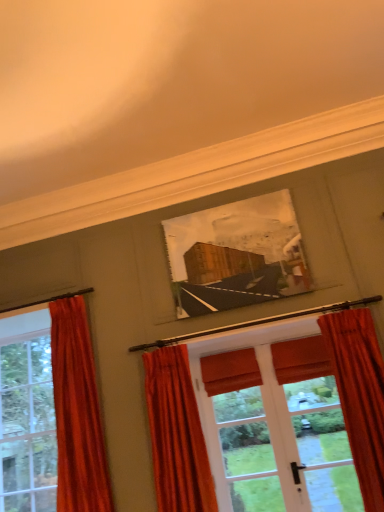
Question: Considering their positions, is velvet red curtain at left, the 1th curtain in the left-to-right sequence, located in front of or behind wooden picture frame at center?

Choices:
 (A) behind
 (B) front

Answer: (B)

Question: From their relative heights in the image, would you say velvet red curtain at left, the 3th curtain when ordered from right to left, is taller or shorter than wooden picture frame at center?

Choices:
 (A) tall
 (B) short

Answer: (A)

Question: Which object is the closest to the velvet orange curtain at lower right, placed as the first curtain when sorted from right to left?

Choices:
 (A) matte orange curtain at left
 (B) velvet orange curtain at center, which is the 2th curtain from right to left
 (C) wooden picture frame at center
 (D) velvet red curtain at left, the 3th curtain when ordered from right to left

Answer: (C)

Question: Estimate the real-world distances between objects in this image. Which object is closer to the velvet orange curtain at center, the second curtain viewed from the left?

Choices:
 (A) matte orange curtain at left
 (B) wooden picture frame at center
 (C) velvet orange curtain at lower right, placed as the first curtain when sorted from right to left
 (D) velvet red curtain at left, the 3th curtain when ordered from right to left

Answer: (D)